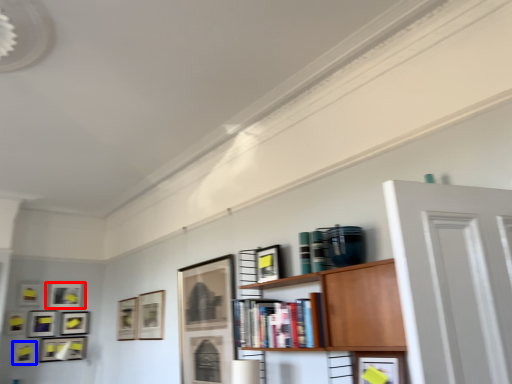
Question: Which point is closer to the camera, picture frame (highlighted by a red box) or picture frame (highlighted by a blue box)?

Choices:
 (A) picture frame
 (B) picture frame

Answer: (B)